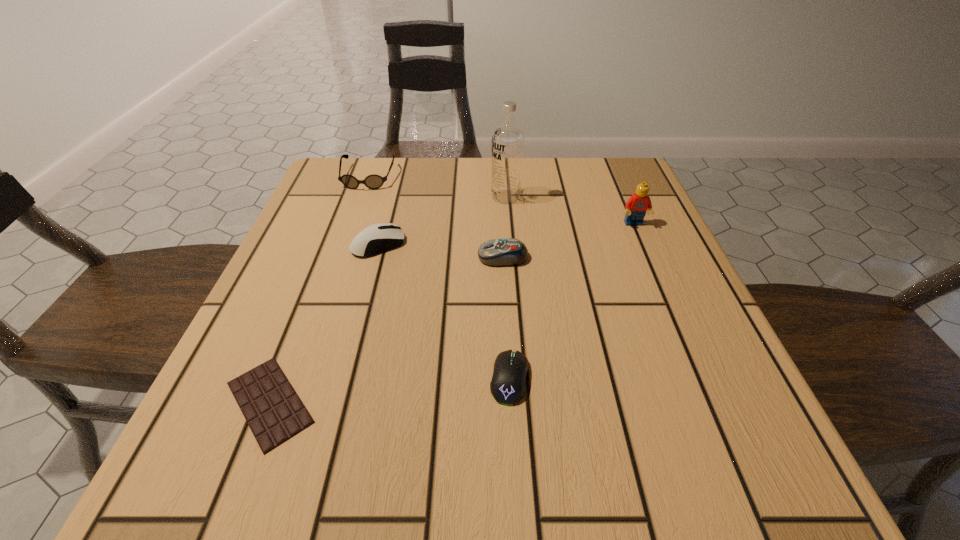
Where is `mouse that is at the left edge`? Image resolution: width=960 pixels, height=540 pixels. mouse that is at the left edge is located at coordinates (380, 237).

At what (x,y) coordinates should I click in order to perform the action: click on chocolate bar at the left edge. Please return your answer as a coordinate pair (x, y). Image resolution: width=960 pixels, height=540 pixels. Looking at the image, I should click on (273, 410).

You are a GUI agent. You are given a task and a screenshot of the screen. Output one action in this format:
    pyautogui.click(x=<x>, y=<y>)
    Task: Click on the object that is at the right edge
    The image size is (960, 540).
    Given the screenshot: What is the action you would take?
    pyautogui.click(x=636, y=206)

Identify the location of object that is positioned at the far left corner. (373, 181).

Find the location of `object that is positioned at the near left corner`. object that is positioned at the near left corner is located at coordinates (273, 410).

Find the location of a particular element. This screenshot has height=540, width=960. free region at the far edge of the desktop is located at coordinates (452, 157).

At what (x,y) coordinates should I click in order to perform the action: click on vacant space at the left edge of the desktop. Please return your answer as a coordinate pair (x, y). This screenshot has height=540, width=960. Looking at the image, I should click on (296, 359).

At what (x,y) coordinates should I click in order to perform the action: click on vacant area at the right edge of the desktop. Please return your answer as a coordinate pair (x, y). This screenshot has width=960, height=540. Looking at the image, I should click on (597, 221).

Image resolution: width=960 pixels, height=540 pixels. I want to click on blank area at the far right corner, so click(619, 174).

This screenshot has width=960, height=540. In order to click on empty location between the chocolate bar and the leftmost computer equipment in this screenshot , I will do `click(324, 323)`.